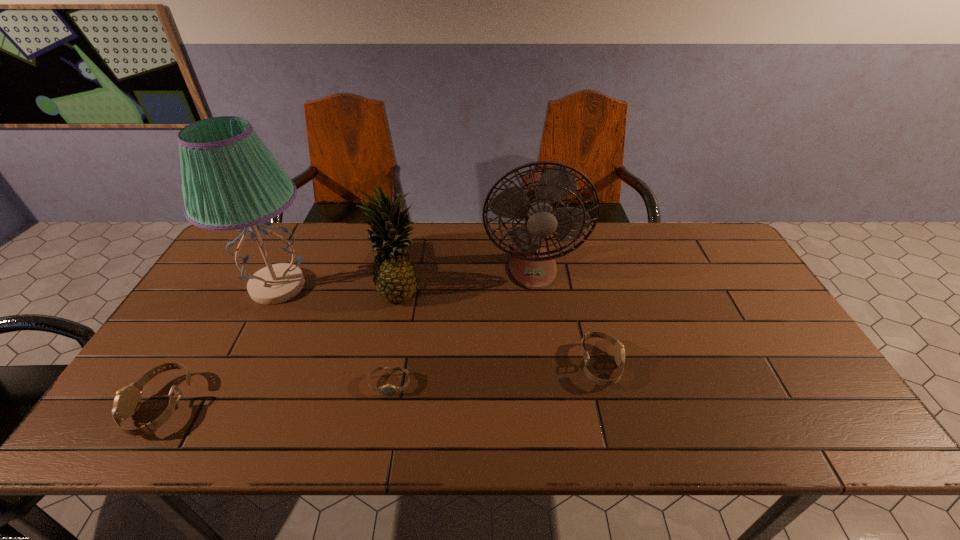
Identify the location of vacant space at the left edge of the desktop. (234, 327).

Find the location of a particular element. blank area at the right edge is located at coordinates (696, 269).

What are the coordinates of `vacant space at the far right corner of the desktop` in the screenshot? It's located at (706, 259).

The width and height of the screenshot is (960, 540). Find the location of `vacant space that's between the second shortest watch and the second watch from right to left`. vacant space that's between the second shortest watch and the second watch from right to left is located at coordinates (494, 375).

Identify the location of empty space between the leftmost watch and the tallest object. (220, 346).

The image size is (960, 540). I want to click on vacant area that lies between the fan and the pineapple, so click(x=466, y=279).

In order to click on blank region between the shortest watch and the second shortest object in this screenshot , I will do `click(494, 375)`.

Find the location of a particular element. The height and width of the screenshot is (540, 960). free area in between the fan and the second watch from left to right is located at coordinates (461, 326).

Where is `free space between the pineapple and the second shortest watch`? The height and width of the screenshot is (540, 960). free space between the pineapple and the second shortest watch is located at coordinates (500, 328).

This screenshot has width=960, height=540. Identify the location of blank region between the rightmost watch and the fan. (566, 316).